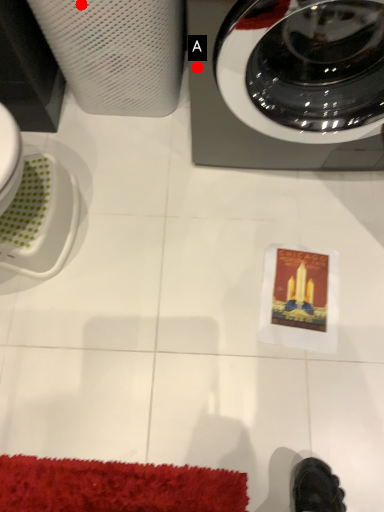
Question: Two points are circled on the image, labeled by A and B beside each circle. Which point is closer to the camera?

Choices:
 (A) A is closer
 (B) B is closer

Answer: (A)